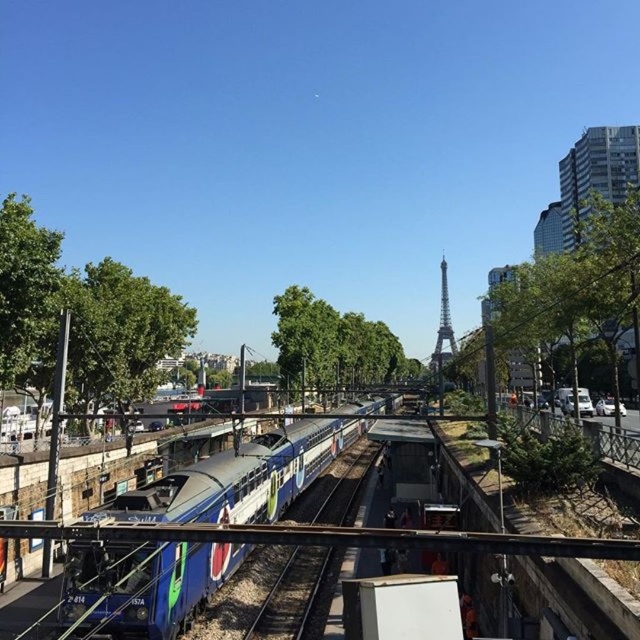
You are a photographer trying to capture both the blue metallic train track at center and the metallic silver tower at center in a single frame. Which object will appear smaller in your photo?

The blue metallic train track at center will appear smaller in the photo because it has a smaller size compared to the metallic silver tower at center.

You are a photographer trying to capture the blue glossy train at center and the blue metallic train track at center in a single shot. Based on their sizes, which object would appear wider in the photo?

The blue glossy train at center would appear wider in the photo since its width is larger than that of the blue metallic train track at center.

You are a photographer trying to capture both the blue glossy train at center and the metallic silver tower at center in the same frame. Based on their sizes, which object would you need to zoom in or out to focus on first?

The blue glossy train at center is thinner than the metallic silver tower at center, so you would need to zoom out first to include both in the frame since the tower is wider.